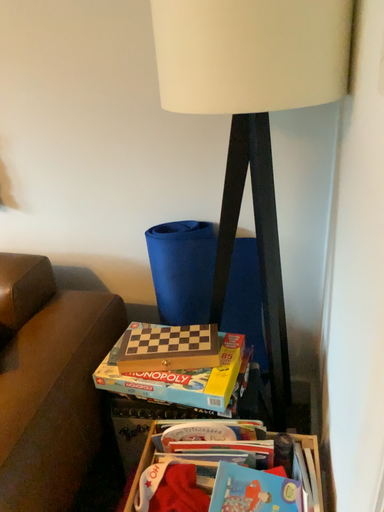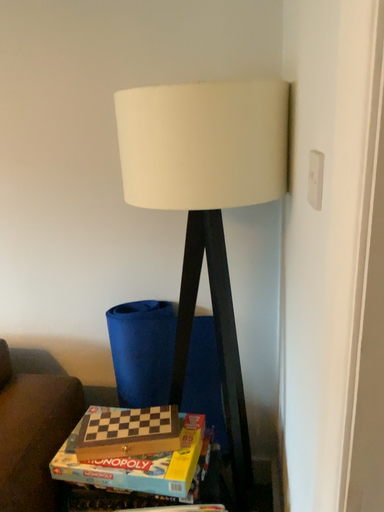
Question: How did the camera likely rotate when shooting the video?

Choices:
 (A) rotated downward
 (B) rotated upward

Answer: (B)